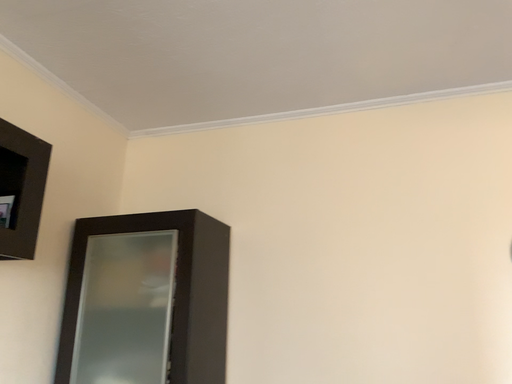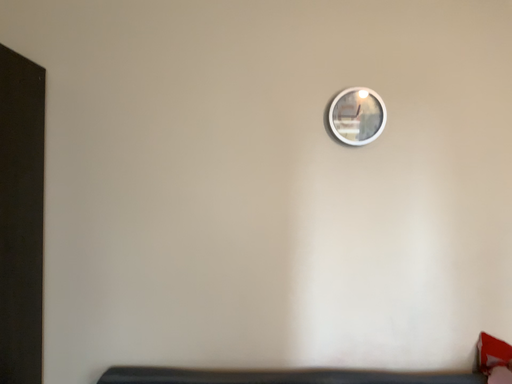
Question: How did the camera likely rotate when shooting the video?

Choices:
 (A) rotated upward
 (B) rotated downward

Answer: (B)